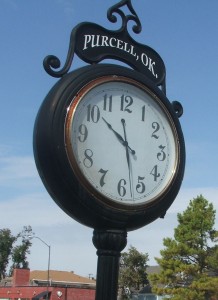
Find the location of `clock`. clock is located at coordinates (151, 146).